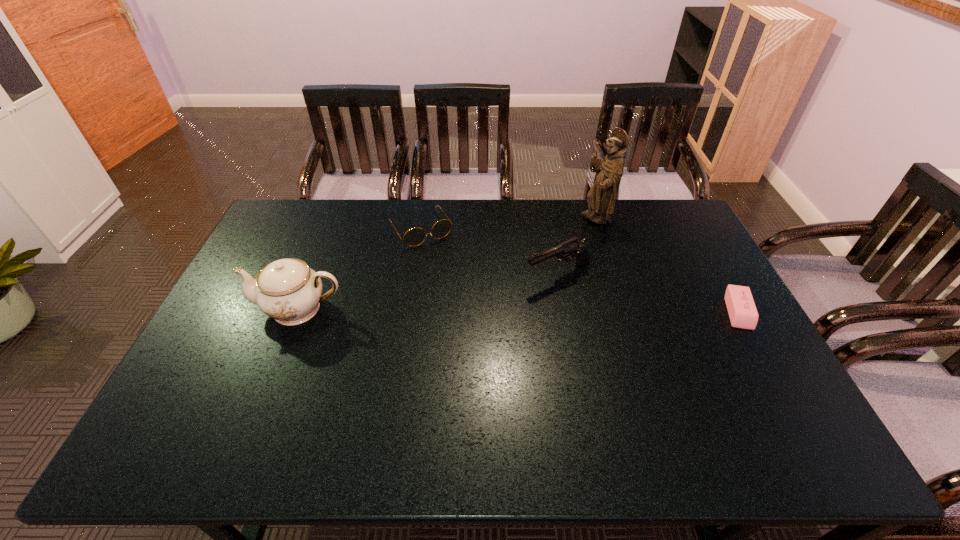
In order to click on the leftmost object in this screenshot , I will do `click(287, 290)`.

I want to click on chinaware, so click(x=287, y=290).

At what (x,y) coordinates should I click in order to perform the action: click on the shortest object. Please return your answer as a coordinate pair (x, y). The width and height of the screenshot is (960, 540). Looking at the image, I should click on (742, 311).

Where is `the rightmost object`? The width and height of the screenshot is (960, 540). the rightmost object is located at coordinates (742, 311).

What are the coordinates of `the second object from left to right` in the screenshot? It's located at (413, 237).

This screenshot has width=960, height=540. Find the location of `the second shortest object`. the second shortest object is located at coordinates (413, 237).

The height and width of the screenshot is (540, 960). I want to click on the tallest object, so click(601, 197).

The height and width of the screenshot is (540, 960). What are the coordinates of `the second object from right to left` in the screenshot? It's located at (601, 197).

You are a GUI agent. You are given a task and a screenshot of the screen. Output one action in this format:
    pyautogui.click(x=<x>, y=<y>)
    Task: Click on the gun
    The width and height of the screenshot is (960, 540).
    Given the screenshot: What is the action you would take?
    pyautogui.click(x=567, y=250)

Identify the location of the third object from right to left. (567, 250).